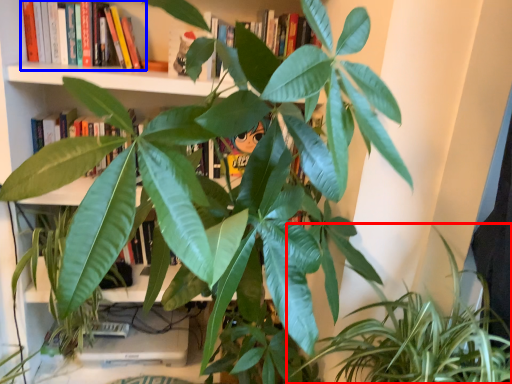
Question: Which of the following is the closest to the observer, houseplant (highlighted by a red box) or book (highlighted by a blue box)?

Choices:
 (A) houseplant
 (B) book

Answer: (A)